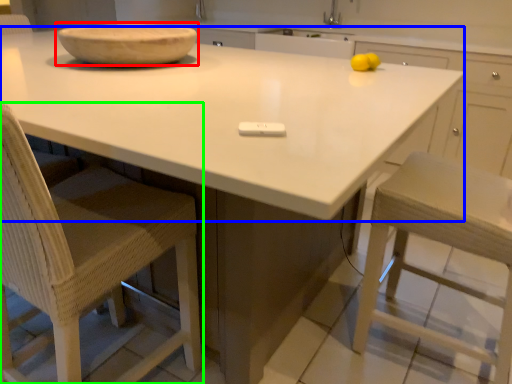
Question: Considering the real-world distances, which object is farthest from bowl (highlighted by a red box)? countertop (highlighted by a blue box) or chair (highlighted by a green box)?

Choices:
 (A) countertop
 (B) chair

Answer: (B)